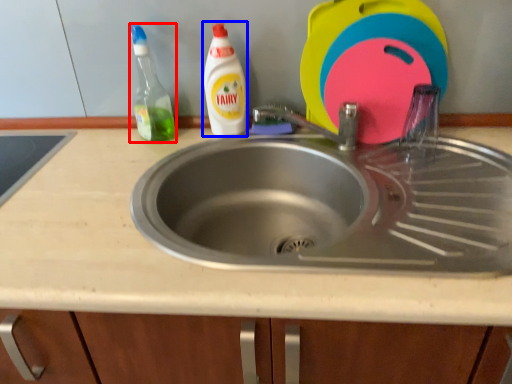
Question: Which object appears closest to the camera in this image, cleaning product (highlighted by a red box) or cleaning product (highlighted by a blue box)?

Choices:
 (A) cleaning product
 (B) cleaning product

Answer: (A)